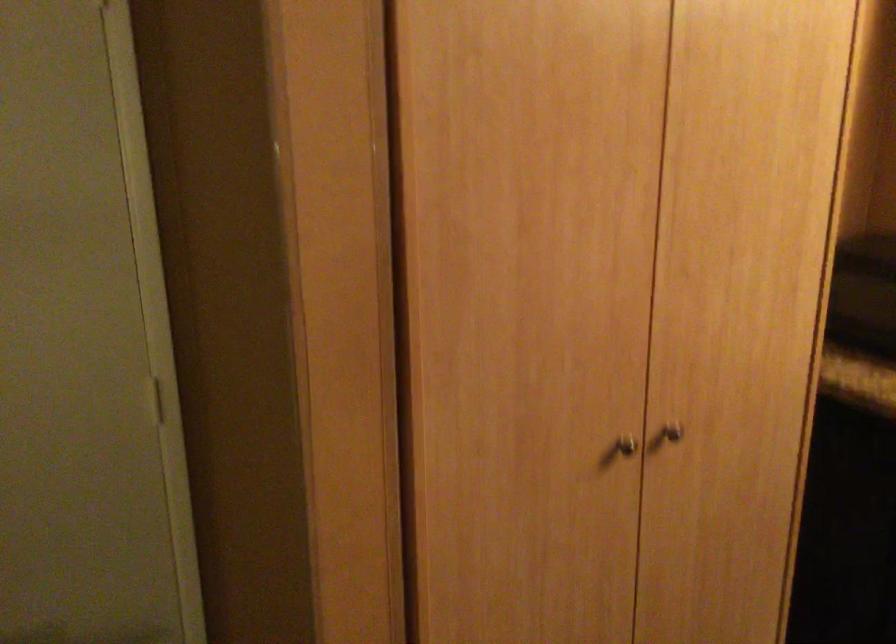
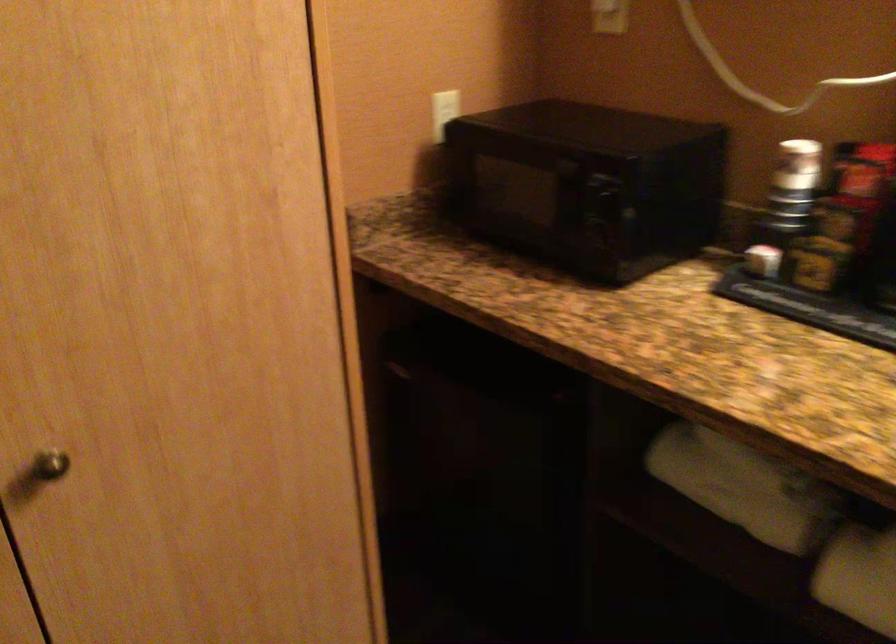
Question: The camera is either moving clockwise (left) or counter-clockwise (right) around the object. The first image is from the beginning of the video and the second image is from the end. Is the camera moving left or right when shooting the video?

Choices:
 (A) Left
 (B) Right

Answer: (A)